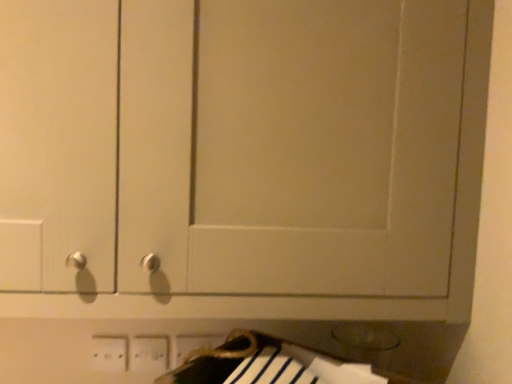
In order to face white plastic electric outlet at lower center, which is counted as the 1th electric outlet, starting from the left, should I rotate leftwards or rightwards?

Rotate left and turn 18.878 degrees.

How much space does white plastic electric outlet at lower center, which ranks as the 3th electric outlet in left-to-right order, occupy vertically?

The height of white plastic electric outlet at lower center, which ranks as the 3th electric outlet in left-to-right order, is 3.72 inches.

I want to click on white plastic electric outlet at lower center, which appears as the first electric outlet when viewed from the right, so click(x=195, y=344).

The width and height of the screenshot is (512, 384). Find the location of `white plastic electric outlet at lower center, arranged as the 3th electric outlet when viewed from the right`. white plastic electric outlet at lower center, arranged as the 3th electric outlet when viewed from the right is located at coordinates (109, 353).

Are white plastic electric outlet at lower center, acting as the 2th electric outlet starting from the left, and white plastic electric outlet at lower center, which is counted as the 1th electric outlet, starting from the left, located far from each other?

They are positioned close to each other.

Who is taller, white plastic electric outlet at lower center, acting as the 2th electric outlet starting from the right, or white plastic electric outlet at lower center, which is counted as the 1th electric outlet, starting from the left?

Standing taller between the two is white plastic electric outlet at lower center, which is counted as the 1th electric outlet, starting from the left.

From a real-world perspective, is white plastic electric outlet at lower center, acting as the 2th electric outlet starting from the right, physically below white plastic electric outlet at lower center, which is counted as the 1th electric outlet, starting from the left?

Actually, white plastic electric outlet at lower center, acting as the 2th electric outlet starting from the right, is physically above white plastic electric outlet at lower center, which is counted as the 1th electric outlet, starting from the left, in the real world.

From the image's perspective, between white plastic electric outlet at lower center, acting as the 2th electric outlet starting from the left, and white plastic electric outlet at lower center, which ranks as the 3th electric outlet in left-to-right order, who is located below?

white plastic electric outlet at lower center, which ranks as the 3th electric outlet in left-to-right order, from the image's perspective.

Could you tell me if white plastic electric outlet at lower center, acting as the 2th electric outlet starting from the left, is turned towards white plastic electric outlet at lower center, which ranks as the 3th electric outlet in left-to-right order?

No, white plastic electric outlet at lower center, acting as the 2th electric outlet starting from the left, is not oriented towards white plastic electric outlet at lower center, which ranks as the 3th electric outlet in left-to-right order.

Does white plastic electric outlet at lower center, acting as the 2th electric outlet starting from the right, have a larger size compared to white plastic electric outlet at lower center, which appears as the first electric outlet when viewed from the right?

Actually, white plastic electric outlet at lower center, acting as the 2th electric outlet starting from the right, might be smaller than white plastic electric outlet at lower center, which appears as the first electric outlet when viewed from the right.

Is white plastic electric outlet at lower center, acting as the 2th electric outlet starting from the right, in contact with white plastic electric outlet at lower center, which appears as the first electric outlet when viewed from the right?

Yes, white plastic electric outlet at lower center, acting as the 2th electric outlet starting from the right, is beside white plastic electric outlet at lower center, which appears as the first electric outlet when viewed from the right.

Would you say white plastic electric outlet at lower center, which appears as the first electric outlet when viewed from the right, is part of white plastic electric outlet at lower center, arranged as the 3th electric outlet when viewed from the right,'s contents?

No, white plastic electric outlet at lower center, which appears as the first electric outlet when viewed from the right, is not surrounded by white plastic electric outlet at lower center, arranged as the 3th electric outlet when viewed from the right.

Could you tell me if white plastic electric outlet at lower center, arranged as the 3th electric outlet when viewed from the right, is turned towards white plastic electric outlet at lower center, which ranks as the 3th electric outlet in left-to-right order?

No, white plastic electric outlet at lower center, arranged as the 3th electric outlet when viewed from the right, is not turned towards white plastic electric outlet at lower center, which ranks as the 3th electric outlet in left-to-right order.

Considering the sizes of objects white plastic electric outlet at lower center, which is counted as the 1th electric outlet, starting from the left, and white plastic electric outlet at lower center, which ranks as the 3th electric outlet in left-to-right order, in the image provided, who is wider, white plastic electric outlet at lower center, which is counted as the 1th electric outlet, starting from the left, or white plastic electric outlet at lower center, which ranks as the 3th electric outlet in left-to-right order,?

With larger width is white plastic electric outlet at lower center, which ranks as the 3th electric outlet in left-to-right order.

Which is in front, point (97, 352) or point (213, 341)?

The point (97, 352) is closer.

From a real-world perspective, count 1st electric outlets upward from the white plastic electric outlet at lower center, which is counted as the 1th electric outlet, starting from the left, and point to it. Please provide its 2D coordinates.

[(149, 354)]

Based on the photo, which object is further away from the camera, white plastic electric outlet at lower center, arranged as the 3th electric outlet when viewed from the right, or white plastic electric outlet at lower center, acting as the 2th electric outlet starting from the left?

white plastic electric outlet at lower center, acting as the 2th electric outlet starting from the left, is further from the camera.

Considering the sizes of objects white plastic electric outlet at lower center, arranged as the 3th electric outlet when viewed from the right, and white plastic electric outlet at lower center, acting as the 2th electric outlet starting from the right, in the image provided, who is smaller, white plastic electric outlet at lower center, arranged as the 3th electric outlet when viewed from the right, or white plastic electric outlet at lower center, acting as the 2th electric outlet starting from the right,?

Smaller between the two is white plastic electric outlet at lower center, arranged as the 3th electric outlet when viewed from the right.

Between point (93, 348) and point (154, 349), which one is positioned behind?

The point (154, 349) is farther from the camera.

Which of these two, white plastic electric outlet at lower center, which appears as the first electric outlet when viewed from the right, or white plastic electric outlet at lower center, acting as the 2th electric outlet starting from the right, stands taller?

white plastic electric outlet at lower center, acting as the 2th electric outlet starting from the right, is taller.

Is white plastic electric outlet at lower center, which ranks as the 3th electric outlet in left-to-right order, oriented towards white plastic electric outlet at lower center, acting as the 2th electric outlet starting from the left?

No, white plastic electric outlet at lower center, which ranks as the 3th electric outlet in left-to-right order, is not facing towards white plastic electric outlet at lower center, acting as the 2th electric outlet starting from the left.

From a real-world perspective, who is located higher, white plastic electric outlet at lower center, which ranks as the 3th electric outlet in left-to-right order, or white plastic electric outlet at lower center, acting as the 2th electric outlet starting from the right?

From a 3D spatial view, white plastic electric outlet at lower center, which ranks as the 3th electric outlet in left-to-right order, is above.

From the image's perspective, is white plastic electric outlet at lower center, which appears as the first electric outlet when viewed from the right, on white plastic electric outlet at lower center, which is counted as the 1th electric outlet, starting from the left?

No.

Looking at this image, considering the relative sizes of white plastic electric outlet at lower center, which appears as the first electric outlet when viewed from the right, and white plastic electric outlet at lower center, which is counted as the 1th electric outlet, starting from the left, in the image provided, is white plastic electric outlet at lower center, which appears as the first electric outlet when viewed from the right, smaller than white plastic electric outlet at lower center, which is counted as the 1th electric outlet, starting from the left,?

No.

From the white plastic electric outlet at lower center, which is counted as the 1th electric outlet, starting from the left, count 2nd electric outlets backward and point to it. Please provide its 2D coordinates.

[(195, 344)]

Could you tell me if white plastic electric outlet at lower center, which appears as the first electric outlet when viewed from the right, is facing white plastic electric outlet at lower center, which is counted as the 1th electric outlet, starting from the left?

No, white plastic electric outlet at lower center, which appears as the first electric outlet when viewed from the right, is not turned towards white plastic electric outlet at lower center, which is counted as the 1th electric outlet, starting from the left.

Where is `electric outlet directly beneath the white plastic electric outlet at lower center, acting as the 2th electric outlet starting from the left (from a real-world perspective)`? The height and width of the screenshot is (384, 512). electric outlet directly beneath the white plastic electric outlet at lower center, acting as the 2th electric outlet starting from the left (from a real-world perspective) is located at coordinates (109, 353).

The height and width of the screenshot is (384, 512). Find the location of `electric outlet behind the white plastic electric outlet at lower center, acting as the 2th electric outlet starting from the right`. electric outlet behind the white plastic electric outlet at lower center, acting as the 2th electric outlet starting from the right is located at coordinates (195, 344).

In the scene shown: Looking at the image, which one is located closer to white plastic electric outlet at lower center, acting as the 2th electric outlet starting from the right, white plastic electric outlet at lower center, which ranks as the 3th electric outlet in left-to-right order, or white plastic electric outlet at lower center, which is counted as the 1th electric outlet, starting from the left?

The object closer to white plastic electric outlet at lower center, acting as the 2th electric outlet starting from the right, is white plastic electric outlet at lower center, which is counted as the 1th electric outlet, starting from the left.

From the image, which object appears to be nearer to white plastic electric outlet at lower center, which is counted as the 1th electric outlet, starting from the left, white plastic electric outlet at lower center, which appears as the first electric outlet when viewed from the right, or white plastic electric outlet at lower center, acting as the 2th electric outlet starting from the right?

Among the two, white plastic electric outlet at lower center, acting as the 2th electric outlet starting from the right, is located nearer to white plastic electric outlet at lower center, which is counted as the 1th electric outlet, starting from the left.

Which object lies further to the anchor point white plastic electric outlet at lower center, which appears as the first electric outlet when viewed from the right, white plastic electric outlet at lower center, arranged as the 3th electric outlet when viewed from the right, or white plastic electric outlet at lower center, acting as the 2th electric outlet starting from the left?

Based on the image, white plastic electric outlet at lower center, arranged as the 3th electric outlet when viewed from the right, appears to be further to white plastic electric outlet at lower center, which appears as the first electric outlet when viewed from the right.

Which object lies further to the anchor point white plastic electric outlet at lower center, arranged as the 3th electric outlet when viewed from the right, white plastic electric outlet at lower center, acting as the 2th electric outlet starting from the left, or white plastic electric outlet at lower center, which appears as the first electric outlet when viewed from the right?

white plastic electric outlet at lower center, which appears as the first electric outlet when viewed from the right.

When comparing their distances from white plastic electric outlet at lower center, acting as the 2th electric outlet starting from the right, does white plastic electric outlet at lower center, which is counted as the 1th electric outlet, starting from the left, or white plastic electric outlet at lower center, which appears as the first electric outlet when viewed from the right, seem closer?

white plastic electric outlet at lower center, which is counted as the 1th electric outlet, starting from the left, is closer to white plastic electric outlet at lower center, acting as the 2th electric outlet starting from the right.

When comparing their distances from white plastic electric outlet at lower center, which appears as the first electric outlet when viewed from the right, does white plastic electric outlet at lower center, acting as the 2th electric outlet starting from the right, or white plastic electric outlet at lower center, arranged as the 3th electric outlet when viewed from the right, seem closer?

white plastic electric outlet at lower center, acting as the 2th electric outlet starting from the right, is closer to white plastic electric outlet at lower center, which appears as the first electric outlet when viewed from the right.

At what (x,y) coordinates should I click in order to perform the action: click on electric outlet located between white plastic electric outlet at lower center, arranged as the 3th electric outlet when viewed from the right, and white plastic electric outlet at lower center, which ranks as the 3th electric outlet in left-to-right order, in the left-right direction. Please return your answer as a coordinate pair (x, y). This screenshot has height=384, width=512. Looking at the image, I should click on (149, 354).